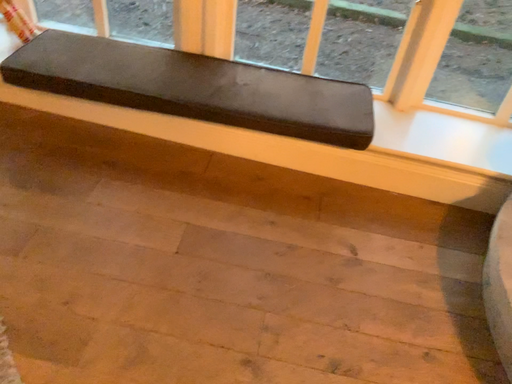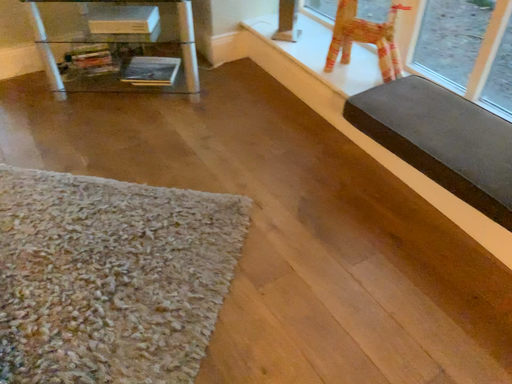
Question: Which way did the camera rotate in the video?

Choices:
 (A) rotated downward
 (B) rotated upward

Answer: (B)